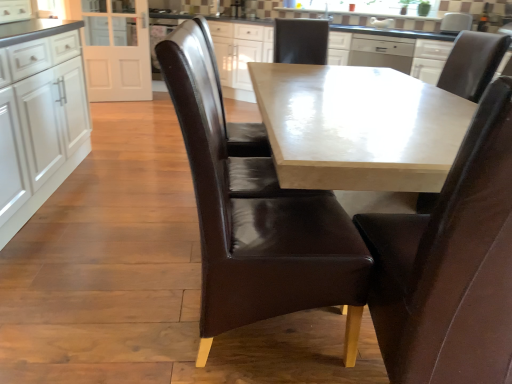
I want to click on vacant point to the right of white glossy cabinets at left, the second cabinetry when ordered from right to left, so click(x=114, y=224).